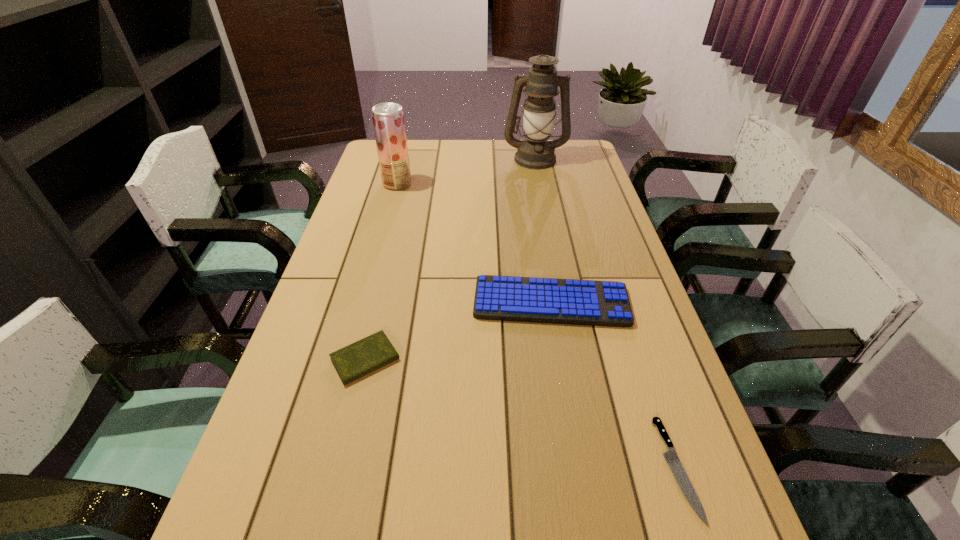
You are a GUI agent. You are given a task and a screenshot of the screen. Output one action in this format:
    pyautogui.click(x=<x>, y=<y>)
    Task: Click on the vacant space located 0.180m on the front of the farthest object
    The width and height of the screenshot is (960, 540).
    Given the screenshot: What is the action you would take?
    pyautogui.click(x=542, y=195)

Identify the location of vacant space located on the back of the second farthest object. This screenshot has height=540, width=960. (405, 155).

Locate an element on the screen. The height and width of the screenshot is (540, 960). vacant region located on the left of the third nearest object is located at coordinates (431, 302).

Locate an element on the screen. vacant area situated 0.090m on the front of the diary is located at coordinates (349, 424).

Where is `free space located on the back of the nearest object`? free space located on the back of the nearest object is located at coordinates (649, 386).

At what (x,y) coordinates should I click in order to perform the action: click on object that is at the far edge. Please return your answer as a coordinate pair (x, y). Image resolution: width=960 pixels, height=540 pixels. Looking at the image, I should click on (535, 152).

Identify the location of fruit juice at the left edge. The height and width of the screenshot is (540, 960). (388, 120).

In order to click on diary that is positioned at the left edge in this screenshot , I will do `click(358, 359)`.

The width and height of the screenshot is (960, 540). Find the location of `oil lamp positioned at the right edge`. oil lamp positioned at the right edge is located at coordinates (535, 152).

Identify the location of computer keyboard that is at the right edge. (505, 298).